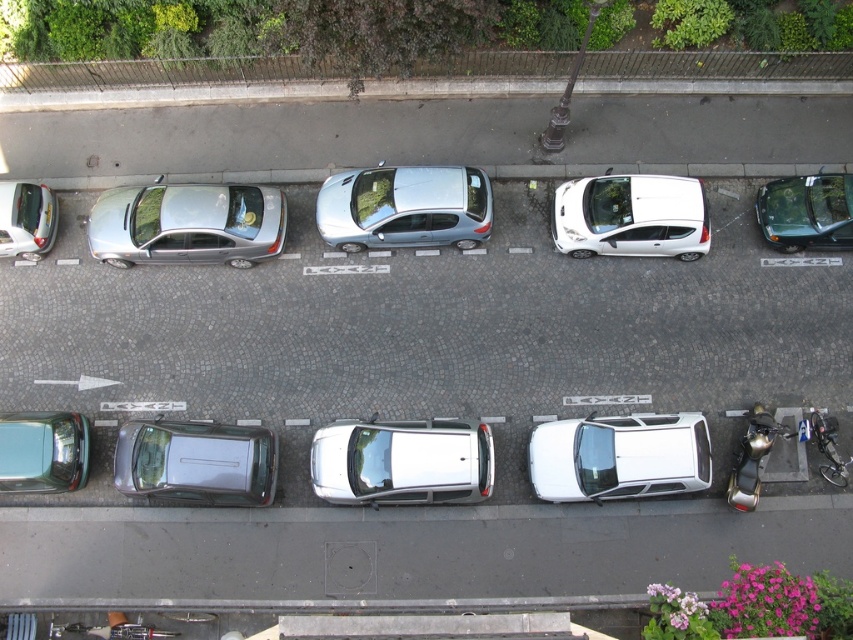
Between satin silver suv at center and shiny silver motorcycle at lower right, which one is positioned higher?

shiny silver motorcycle at lower right

Who is more distant from viewer, (468, 500) or (740, 444)?

The point (740, 444) is more distant.

Where is `satin silver suv at center`? satin silver suv at center is located at coordinates coord(402,461).

Is white glossy car at center wider than shiny silver motorcycle at lower right?

Yes, white glossy car at center is wider than shiny silver motorcycle at lower right.

Based on the photo, can you confirm if white glossy car at center is positioned above shiny silver motorcycle at lower right?

No, white glossy car at center is not above shiny silver motorcycle at lower right.

Who is more forward, [601,468] or [753,412]?

Point [601,468]

What are the coordinates of `white glossy car at center` in the screenshot? It's located at (619, 456).

Between white glossy hatchback at center and shiny silver motorcycle at lower right, which one is positioned lower?

shiny silver motorcycle at lower right is below.

Does white glossy hatchback at center come in front of shiny silver motorcycle at lower right?

No, white glossy hatchback at center is further to the viewer.

Does point (669, 209) come closer to viewer compared to point (755, 454)?

No, (669, 209) is further to viewer.

This screenshot has height=640, width=853. In order to click on white glossy hatchback at center in this screenshot , I will do `click(630, 216)`.